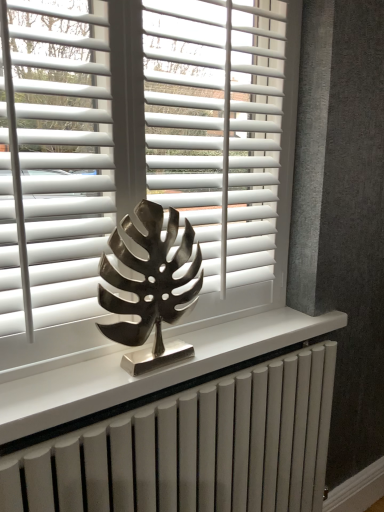
Question: From the image's perspective, relative to metallic leaf sculpture at center, is white metallic radiator at center above or below?

Choices:
 (A) below
 (B) above

Answer: (A)

Question: Considering the positions of white metallic radiator at center and metallic leaf sculpture at center in the image, is white metallic radiator at center bigger or smaller than metallic leaf sculpture at center?

Choices:
 (A) small
 (B) big

Answer: (B)

Question: Which object is the farthest from the white matte blinds at center, which is the 2th blind in right-to-left order?

Choices:
 (A) metallic leaf sculpture at center
 (B) white matte blinds at center, which is the 2th blind in left-to-right order
 (C) white metallic radiator at center
 (D) white matte blinds at center

Answer: (C)

Question: Estimate the real-world distances between objects in this image. Which object is closer to the white matte blinds at center, which ranks as the 1th blind in right-to-left order?

Choices:
 (A) white matte blinds at center
 (B) white metallic radiator at center
 (C) metallic leaf sculpture at center
 (D) white matte blinds at center, which is the 2th blind in right-to-left order

Answer: (A)